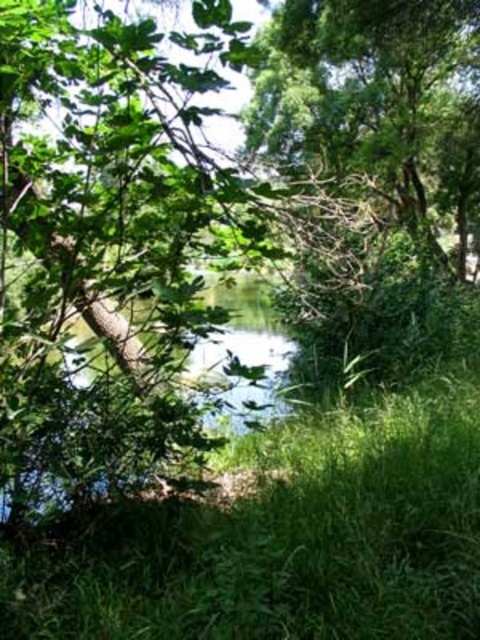
Looking at this image, you are an environmental scientist observing the scene. You need to determine which object is taller between the green leafy grass at center and the green leafy tree at upper center. Which one is taller?

The green leafy tree at upper center is taller than the green leafy grass at center according to the description.

You are a hiker who wants to set up a tent between the green leafy grass at center and the green leafy tree at upper center. The tent requires a minimum of 30 feet of space to avoid tree roots. Based on the scene, can you safely set up the tent in that area?

The distance between the green leafy grass at center and the green leafy tree at upper center is 28.16 feet, which is less than the required 30 feet. Therefore, you cannot safely set up the tent there due to insufficient space to avoid tree roots.

Based on the scene description, what is located at the coordinates point (283, 538)?

The point (283, 538) is where the green leafy grass at center is located.